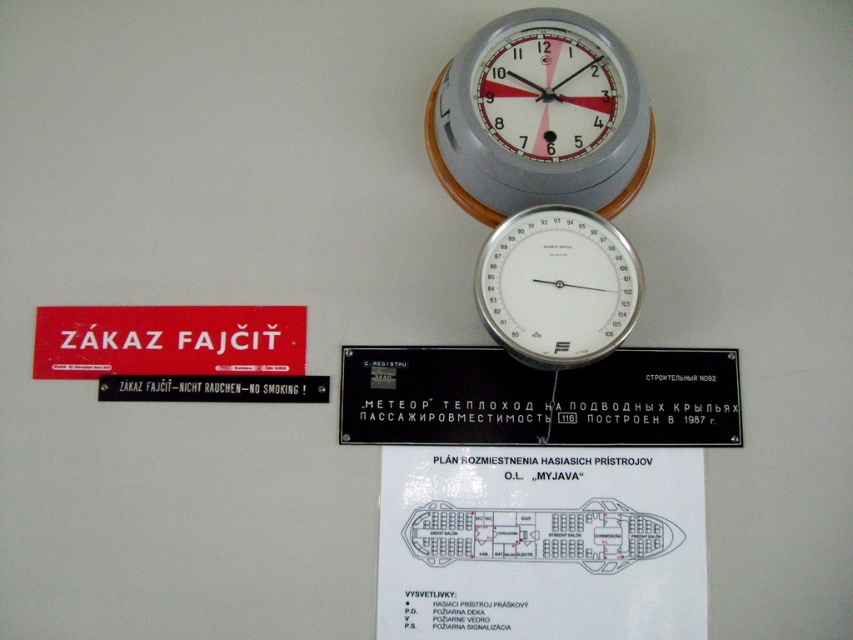
You are a ship captain checking the navigation instruments on the wall. You need to adjust the black plastic sign at upper center and the black plastic sign at left so they are closer together. How much space do you need to reduce between them?

The current distance between the black plastic sign at upper center and the black plastic sign at left is 26.32 centimeters. To make them closer, you need to reduce the space by at least some amount, but the exact required reduction isn

You are an interior designer assessing the wall layout. The matte gray clock at upper center and the black plastic sign at left are both mounted on the wall. Which object has a greater width?

The matte gray clock at upper center has a greater width than the black plastic sign at left.

You are a sailor on a ship looking at the wall display. You need to locate the black plastic sign at upper center and the black plastic sign at left. Which one is positioned lower?

The black plastic sign at upper center is positioned lower than the black plastic sign at left.